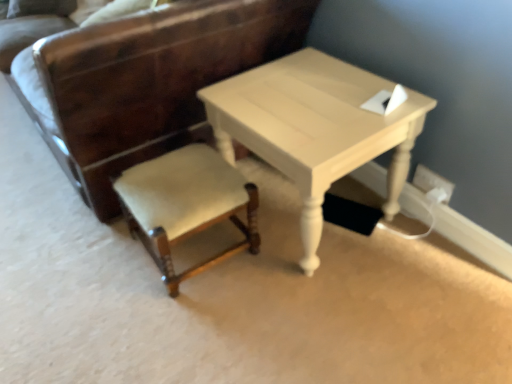
What is the approximate width of light beige wood table at center?

light beige wood table at center is 21.05 inches in width.

Measure the distance between velvet beige chair at lower left, the 1th chair when ordered from top to bottom, and camera.

A distance of 1.11 meters exists between velvet beige chair at lower left, the 1th chair when ordered from top to bottom, and camera.

What do you see at coordinates (432, 181) in the screenshot?
I see `white plastic electric outlet at lower right` at bounding box center [432, 181].

Where is `light beige wood table at center`? The height and width of the screenshot is (384, 512). light beige wood table at center is located at coordinates (314, 128).

Is white plastic electric outlet at lower right turned away from light beige wood table at center?

white plastic electric outlet at lower right is not turned away from light beige wood table at center.

Is point (420, 165) closer or farther from the camera than point (370, 130)?

Point (420, 165).

Is white plastic electric outlet at lower right surrounding light beige wood table at center?

No.

Is white plastic electric outlet at lower right wider or thinner than velvet beige stool at center, the 2th chair in the top-to-bottom sequence?

Clearly, white plastic electric outlet at lower right has less width compared to velvet beige stool at center, the 2th chair in the top-to-bottom sequence.

Does point (428, 190) come behind point (118, 179)?

That is False.

Between white plastic electric outlet at lower right and velvet beige stool at center, which appears as the 1th chair when ordered from the bottom, which one is positioned behind?

white plastic electric outlet at lower right is further from the camera.

In the scene shown: Measure the distance from velvet beige stool at center, the 2th chair in the top-to-bottom sequence, to velvet beige chair at lower left, the 1th chair when ordered from top to bottom.

velvet beige stool at center, the 2th chair in the top-to-bottom sequence, is 12.22 inches away from velvet beige chair at lower left, the 1th chair when ordered from top to bottom.

Locate an element on the screen. This screenshot has width=512, height=384. chair above the velvet beige stool at center, which appears as the 1th chair when ordered from the bottom (from the image's perspective) is located at coordinates (144, 82).

Considering their positions, is velvet beige stool at center, the 2th chair in the top-to-bottom sequence, located in front of or behind velvet beige chair at lower left, the 1th chair when ordered from top to bottom?

velvet beige stool at center, the 2th chair in the top-to-bottom sequence, is behind velvet beige chair at lower left, the 1th chair when ordered from top to bottom.

Is point (253, 186) in front of point (99, 192)?

That is True.

Is the surface of velvet beige chair at lower left, the 2th chair positioned from the bottom, in direct contact with white plastic electric outlet at lower right?

velvet beige chair at lower left, the 2th chair positioned from the bottom, is not next to white plastic electric outlet at lower right, and they're not touching.

Which is nearer, [156,12] or [421,176]?

Point [156,12]

Between velvet beige chair at lower left, the 2th chair positioned from the bottom, and white plastic electric outlet at lower right, which one appears on the right side from the viewer's perspective?

Positioned to the right is white plastic electric outlet at lower right.

Is velvet beige chair at lower left, the 2th chair positioned from the bottom, taller or shorter than white plastic electric outlet at lower right?

Clearly, velvet beige chair at lower left, the 2th chair positioned from the bottom, is taller compared to white plastic electric outlet at lower right.

Is velvet beige stool at center, the 2th chair in the top-to-bottom sequence, oriented towards light beige wood table at center?

No, velvet beige stool at center, the 2th chair in the top-to-bottom sequence, does not turn towards light beige wood table at center.

Considering the relative sizes of velvet beige stool at center, the 2th chair in the top-to-bottom sequence, and light beige wood table at center in the image provided, is velvet beige stool at center, the 2th chair in the top-to-bottom sequence, bigger than light beige wood table at center?

No.

From the image's perspective, is velvet beige stool at center, the 2th chair in the top-to-bottom sequence, under light beige wood table at center?

Indeed, from the image's perspective, velvet beige stool at center, the 2th chair in the top-to-bottom sequence, is shown beneath light beige wood table at center.

Does velvet beige stool at center, which appears as the 1th chair when ordered from the bottom, have a greater height compared to light beige wood table at center?

In fact, velvet beige stool at center, which appears as the 1th chair when ordered from the bottom, may be shorter than light beige wood table at center.

Would you say light beige wood table at center is a long distance from velvet beige stool at center, which appears as the 1th chair when ordered from the bottom?

No, there isn't a large distance between light beige wood table at center and velvet beige stool at center, which appears as the 1th chair when ordered from the bottom.

Is light beige wood table at center closer to the viewer compared to velvet beige stool at center, the 2th chair in the top-to-bottom sequence?

Yes, it is.

Who is bigger, light beige wood table at center or velvet beige stool at center, which appears as the 1th chair when ordered from the bottom?

light beige wood table at center is bigger.

Would you say velvet beige chair at lower left, the 2th chair positioned from the bottom, is inside or outside velvet beige stool at center, which appears as the 1th chair when ordered from the bottom?

velvet beige chair at lower left, the 2th chair positioned from the bottom, lies outside velvet beige stool at center, which appears as the 1th chair when ordered from the bottom.

Considering the sizes of velvet beige chair at lower left, the 1th chair when ordered from top to bottom, and velvet beige stool at center, which appears as the 1th chair when ordered from the bottom, in the image, is velvet beige chair at lower left, the 1th chair when ordered from top to bottom, bigger or smaller than velvet beige stool at center, which appears as the 1th chair when ordered from the bottom,?

velvet beige chair at lower left, the 1th chair when ordered from top to bottom, is bigger than velvet beige stool at center, which appears as the 1th chair when ordered from the bottom.

From a real-world perspective, between velvet beige chair at lower left, the 1th chair when ordered from top to bottom, and velvet beige stool at center, the 2th chair in the top-to-bottom sequence, who is vertically higher?

velvet beige chair at lower left, the 1th chair when ordered from top to bottom.

Locate an element on the screen. chair below the velvet beige chair at lower left, the 2th chair positioned from the bottom (from the image's perspective) is located at coordinates (185, 204).

Find the location of a particular element. This screenshot has width=512, height=384. table in front of the white plastic electric outlet at lower right is located at coordinates (314, 128).

Locate an element on the screen. Image resolution: width=512 pixels, height=384 pixels. electric outlet that is above the velvet beige stool at center, which appears as the 1th chair when ordered from the bottom (from a real-world perspective) is located at coordinates (432, 181).

From the picture: From the image, which object appears to be nearer to light beige wood table at center, white plastic electric outlet at lower right or velvet beige chair at lower left, the 1th chair when ordered from top to bottom?

velvet beige chair at lower left, the 1th chair when ordered from top to bottom, is closer to light beige wood table at center.

From the image, which object appears to be farther from light beige wood table at center, velvet beige stool at center, which appears as the 1th chair when ordered from the bottom, or white plastic electric outlet at lower right?

The object further to light beige wood table at center is white plastic electric outlet at lower right.

When comparing their distances from white plastic electric outlet at lower right, does velvet beige stool at center, the 2th chair in the top-to-bottom sequence, or velvet beige chair at lower left, the 2th chair positioned from the bottom, seem further?

Among the two, velvet beige chair at lower left, the 2th chair positioned from the bottom, is located further to white plastic electric outlet at lower right.

When comparing their distances from velvet beige stool at center, which appears as the 1th chair when ordered from the bottom, does white plastic electric outlet at lower right or light beige wood table at center seem closer?

light beige wood table at center is closer to velvet beige stool at center, which appears as the 1th chair when ordered from the bottom.

Based on their spatial positions, is white plastic electric outlet at lower right or light beige wood table at center closer to velvet beige chair at lower left, the 2th chair positioned from the bottom?

light beige wood table at center lies closer to velvet beige chair at lower left, the 2th chair positioned from the bottom, than the other object.

Which object lies further to the anchor point white plastic electric outlet at lower right, velvet beige stool at center, which appears as the 1th chair when ordered from the bottom, or light beige wood table at center?

velvet beige stool at center, which appears as the 1th chair when ordered from the bottom, lies further to white plastic electric outlet at lower right than the other object.

When comparing their distances from white plastic electric outlet at lower right, does velvet beige chair at lower left, the 2th chair positioned from the bottom, or velvet beige stool at center, which appears as the 1th chair when ordered from the bottom, seem further?

The object further to white plastic electric outlet at lower right is velvet beige chair at lower left, the 2th chair positioned from the bottom.

Estimate the real-world distances between objects in this image. Which object is further from light beige wood table at center, velvet beige chair at lower left, the 2th chair positioned from the bottom, or velvet beige stool at center, which appears as the 1th chair when ordered from the bottom?

The object further to light beige wood table at center is velvet beige chair at lower left, the 2th chair positioned from the bottom.

Locate an element on the screen. This screenshot has height=384, width=512. chair between velvet beige chair at lower left, the 1th chair when ordered from top to bottom, and white plastic electric outlet at lower right from left to right is located at coordinates [185, 204].

The height and width of the screenshot is (384, 512). I want to click on table between velvet beige stool at center, the 2th chair in the top-to-bottom sequence, and white plastic electric outlet at lower right from left to right, so click(x=314, y=128).

In order to click on table that lies between velvet beige chair at lower left, the 2th chair positioned from the bottom, and velvet beige stool at center, the 2th chair in the top-to-bottom sequence, from top to bottom in this screenshot , I will do `click(314, 128)`.

Where is `table situated between velvet beige chair at lower left, the 2th chair positioned from the bottom, and white plastic electric outlet at lower right from left to right`? Image resolution: width=512 pixels, height=384 pixels. table situated between velvet beige chair at lower left, the 2th chair positioned from the bottom, and white plastic electric outlet at lower right from left to right is located at coordinates (314, 128).